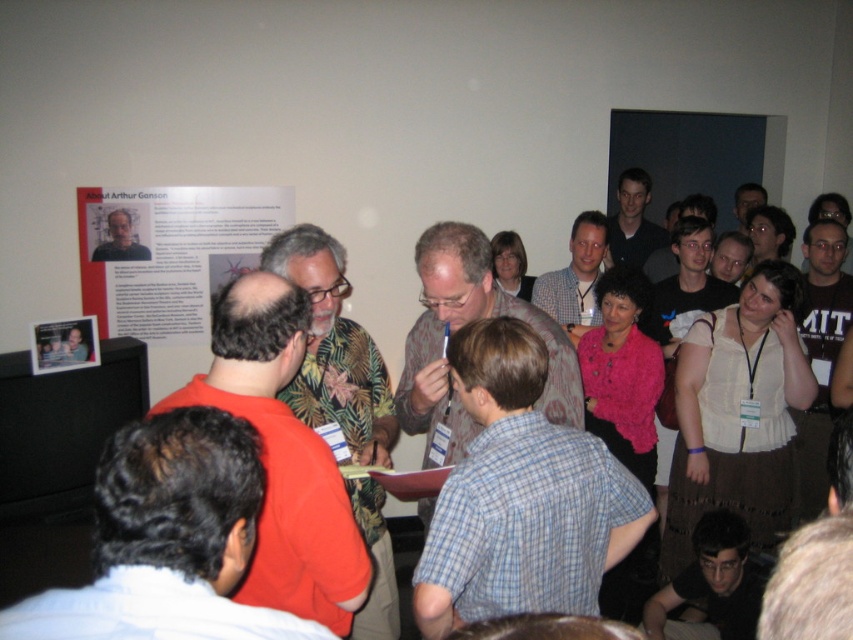
Between point (601, 237) and point (737, 193), which one is positioned behind?

The point (737, 193) is behind.

Is point (538, 296) positioned in front of point (757, 193)?

That is True.

Where is `matte gray shirt at center`? Image resolution: width=853 pixels, height=640 pixels. matte gray shirt at center is located at coordinates (575, 276).

Does dark brown hair at center have a lesser height compared to orange shirt at center?

Indeed, dark brown hair at center has a lesser height compared to orange shirt at center.

Is dark brown hair at center positioned in front of orange shirt at center?

Yes, dark brown hair at center is in front of orange shirt at center.

Between point (207, 593) and point (305, 522), which one is positioned in front?

Positioned in front is point (207, 593).

The image size is (853, 640). Find the location of `dark brown hair at center`. dark brown hair at center is located at coordinates (167, 540).

Is matte paper poster at upper left smaller than matte black shirt at upper right?

No, matte paper poster at upper left is not smaller than matte black shirt at upper right.

You are a GUI agent. You are given a task and a screenshot of the screen. Output one action in this format:
    pyautogui.click(x=<x>, y=<y>)
    Task: Click on the matte paper poster at upper left
    This screenshot has height=640, width=853.
    Given the screenshot: What is the action you would take?
    pyautogui.click(x=170, y=253)

Which is in front, point (170, 280) or point (752, 214)?

Point (170, 280)

Find the location of a particular element. This screenshot has height=640, width=853. matte paper poster at upper left is located at coordinates (170, 253).